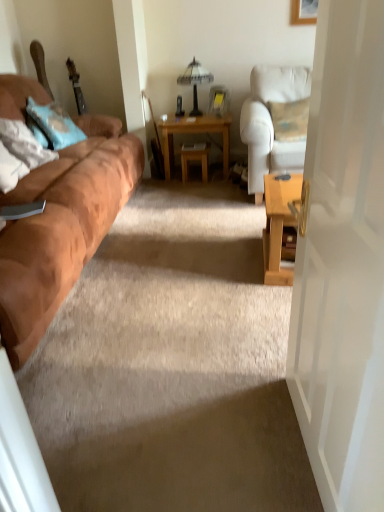
Question: From the image's perspective, is suede brown couch at left on light brown wooden table at center?

Choices:
 (A) no
 (B) yes

Answer: (A)

Question: Is suede brown couch at left facing towards light brown wooden table at center?

Choices:
 (A) no
 (B) yes

Answer: (A)

Question: Considering the relative positions of suede brown couch at left and light brown wooden table at center in the image provided, is suede brown couch at left to the right of light brown wooden table at center from the viewer's perspective?

Choices:
 (A) no
 (B) yes

Answer: (A)

Question: Is suede brown couch at left far from light brown wooden table at center?

Choices:
 (A) yes
 (B) no

Answer: (A)

Question: From the image's perspective, does suede brown couch at left appear lower than light brown wooden table at center?

Choices:
 (A) yes
 (B) no

Answer: (A)

Question: Is wooden stool at center taller or shorter than soft white pillow at left, which ranks as the 1th pillow in front-to-back order?

Choices:
 (A) short
 (B) tall

Answer: (A)

Question: Considering their positions, is wooden stool at center located in front of or behind soft white pillow at left, which ranks as the 1th pillow in front-to-back order?

Choices:
 (A) behind
 (B) front

Answer: (A)

Question: Is wooden stool at center situated inside soft white pillow at left, which is the 2th pillow from back to front, or outside?

Choices:
 (A) inside
 (B) outside

Answer: (B)

Question: In terms of width, does wooden stool at center look wider or thinner when compared to soft white pillow at left, which ranks as the 1th pillow in front-to-back order?

Choices:
 (A) thin
 (B) wide

Answer: (A)

Question: From a real-world perspective, relative to soft white pillow at left, which ranks as the 1th pillow in front-to-back order, is light blue fabric pillow at left, the first pillow positioned from the back, vertically above or below?

Choices:
 (A) above
 (B) below

Answer: (B)

Question: From the image's perspective, relative to soft white pillow at left, which ranks as the 1th pillow in front-to-back order, is light blue fabric pillow at left, the second pillow in the front-to-back sequence, above or below?

Choices:
 (A) above
 (B) below

Answer: (A)

Question: In terms of width, does light blue fabric pillow at left, the second pillow in the front-to-back sequence, look wider or thinner when compared to soft white pillow at left, which is the 2th pillow from back to front?

Choices:
 (A) wide
 (B) thin

Answer: (A)

Question: Does point tap(46, 128) appear closer or farther from the camera than point tap(41, 150)?

Choices:
 (A) farther
 (B) closer

Answer: (A)

Question: Is light brown wooden table at center taller or shorter than light blue fabric pillow at left, the second pillow in the front-to-back sequence?

Choices:
 (A) short
 (B) tall

Answer: (B)

Question: Is light brown wooden table at center in front of or behind light blue fabric pillow at left, the second pillow in the front-to-back sequence, in the image?

Choices:
 (A) front
 (B) behind

Answer: (B)